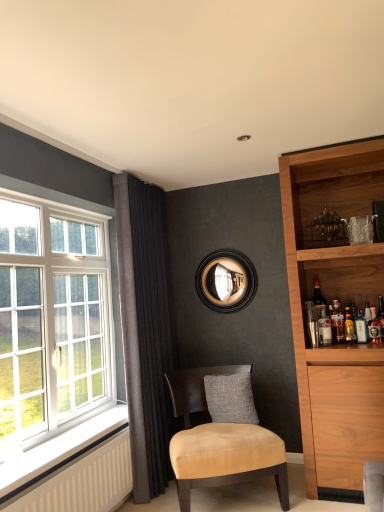
Measure the distance between point (319, 298) and camera.

Point (319, 298) and camera are 3.18 meters apart.

Describe the element at coordinates (52, 320) in the screenshot. This screenshot has height=512, width=384. I see `white glass window at left` at that location.

Measure the distance between point [380,337] and camera.

Point [380,337] is 10.02 feet from camera.

The image size is (384, 512). In order to click on translucent glass bottle at upper right, marked as the 2th beverage in a left-to-right arrangement in this screenshot , I will do `click(337, 322)`.

How much space does translucent glass bottle at right, which appears as the 1th bottle when viewed from the right, occupy vertically?

A: translucent glass bottle at right, which appears as the 1th bottle when viewed from the right, is 8.98 inches in height.

Measure the distance between translucent glass bottle at right, placed as the second bottle when sorted from left to right, and camera.

translucent glass bottle at right, placed as the second bottle when sorted from left to right, and camera are 2.99 meters apart.

Where is `shiny dark glass bottle at upper right, the 1th bottle when ordered from back to front`? shiny dark glass bottle at upper right, the 1th bottle when ordered from back to front is located at coordinates (318, 298).

Find the location of a particular element. The width and height of the screenshot is (384, 512). window on the left side of shiny dark glass bottle at upper right, which is the second bottle from right to left is located at coordinates (52, 320).

Are white glass window at left and shiny dark glass bottle at upper right, which is the second bottle from right to left, located far from each other?

Absolutely, white glass window at left is distant from shiny dark glass bottle at upper right, which is the second bottle from right to left.

Between white glass window at left and shiny dark glass bottle at upper right, the 1th bottle when ordered from back to front, which one has more height?

white glass window at left is taller.

Which object is positioned more to the right, white glass window at left or shiny dark glass bottle at upper right, the first bottle when ordered from left to right?

From the viewer's perspective, shiny dark glass bottle at upper right, the first bottle when ordered from left to right, appears more on the right side.

From a real-world perspective, is white glass window at left under suede beige chair at center?

No, from a real-world perspective, white glass window at left is not under suede beige chair at center.

Is white glass window at left further to the viewer compared to suede beige chair at center?

No.

Is white glass window at left positioned with its back to suede beige chair at center?

No, white glass window at left is not facing the opposite direction of suede beige chair at center.

Considering the sizes of objects white glass window at left and suede beige chair at center in the image provided, who is taller, white glass window at left or suede beige chair at center?

Standing taller between the two is white glass window at left.

Considering the positions of objects black wood mirror at upper center and shiny dark glass bottle at upper right, which is the second bottle from right to left, in the image provided, who is in front, black wood mirror at upper center or shiny dark glass bottle at upper right, which is the second bottle from right to left,?

shiny dark glass bottle at upper right, which is the second bottle from right to left.

From the image's perspective, between black wood mirror at upper center and shiny dark glass bottle at upper right, which is the second bottle from right to left, who is located below?

shiny dark glass bottle at upper right, which is the second bottle from right to left, appears lower in the image.

Between black wood mirror at upper center and shiny dark glass bottle at upper right, which is the second bottle from right to left, which one has smaller size?

Smaller between the two is shiny dark glass bottle at upper right, which is the second bottle from right to left.

Locate an element on the screen. Image resolution: width=384 pixels, height=512 pixels. picture frame lying above the shiny dark glass bottle at upper right, which is the second bottle from right to left (from the image's perspective) is located at coordinates (226, 281).

From the image's perspective, relative to gray fabric pillow at center, is shiny dark glass bottle at upper right, the first bottle when ordered from left to right, above or below?

Clearly, from the image's perspective, shiny dark glass bottle at upper right, the first bottle when ordered from left to right, is above gray fabric pillow at center.

From a real-world perspective, who is located lower, shiny dark glass bottle at upper right, marked as the 2th bottle in a front-to-back arrangement, or gray fabric pillow at center?

gray fabric pillow at center.

This screenshot has width=384, height=512. I want to click on the 2nd bottle directly above the gray fabric pillow at center (from a real-world perspective), so click(x=318, y=298).

Is gray fabric pillow at center at the back of shiny dark glass bottle at upper right, the first bottle when ordered from left to right?

No, shiny dark glass bottle at upper right, the first bottle when ordered from left to right, is not facing the opposite direction of gray fabric pillow at center.

Consider the image. Who is shorter, translucent glass bottle at upper right, marked as the 2th beverage in a left-to-right arrangement, or suede beige chair at center?

translucent glass bottle at upper right, marked as the 2th beverage in a left-to-right arrangement.

What's the angular difference between translucent glass bottle at upper right, which appears as the 3th beverage when viewed from the right, and suede beige chair at center's facing directions?

translucent glass bottle at upper right, which appears as the 3th beverage when viewed from the right, and suede beige chair at center are facing 31.9 degrees away from each other.

From a real-world perspective, starting from the suede beige chair at center, which beverage is the 4th one vertically above it? Please provide its 2D coordinates.

[(337, 322)]

How far apart are translucent glass bottle at upper right, marked as the 2th beverage in a left-to-right arrangement, and suede beige chair at center?

translucent glass bottle at upper right, marked as the 2th beverage in a left-to-right arrangement, and suede beige chair at center are 1.07 meters apart.

How different are the orientations of gray fabric pillow at center and suede beige chair at center in degrees?

There is a 40.1-degree angle between the facing directions of gray fabric pillow at center and suede beige chair at center.

Locate an element on the screen. pillow located above the suede beige chair at center (from a real-world perspective) is located at coordinates (230, 398).

Is gray fabric pillow at center at the right side of suede beige chair at center?

Correct, you'll find gray fabric pillow at center to the right of suede beige chair at center.

Consider the image. Based on their positions, is white glass window at left located to the left or right of translucent glass bottle at upper right, which appears as the 3th beverage when viewed from the right?

white glass window at left is to the left of translucent glass bottle at upper right, which appears as the 3th beverage when viewed from the right.

Is point (102, 344) closer to camera compared to point (343, 328)?

No.

Who is taller, white glass window at left or translucent glass bottle at upper right, marked as the 2th beverage in a left-to-right arrangement?

With more height is white glass window at left.

You are a GUI agent. You are given a task and a screenshot of the screen. Output one action in this format:
    pyautogui.click(x=<x>, y=<y>)
    Task: Click on the bottle above the white glass window at left (from the image's perspective)
    The width and height of the screenshot is (384, 512).
    Given the screenshot: What is the action you would take?
    pyautogui.click(x=318, y=298)

What are the coordinates of `chair that appears behind the white glass window at left` in the screenshot? It's located at (220, 442).

From the image, which object appears to be farther from clear glass bottle at upper right, acting as the fourth beverage starting from the right, white glass window at left or gray fabric pillow at center?

white glass window at left lies further to clear glass bottle at upper right, acting as the fourth beverage starting from the right, than the other object.

When comparing their distances from white glass window at left, does translucent glass bottle at right, which appears as the second bottle when viewed from the back, or translucent glass bottle at right, placed as the first beverage when sorted from right to left, seem further?

Among the two, translucent glass bottle at right, placed as the first beverage when sorted from right to left, is located further to white glass window at left.

Based on their spatial positions, is white glass window at left or gray fabric pillow at center further from white textured radiator at lower left?

gray fabric pillow at center is positioned further to the anchor white textured radiator at lower left.

Estimate the real-world distances between objects in this image. Which object is further from translucent glass bottle at right, the 1th bottle in the front-to-back sequence, translucent glass bottle at right, the fourth beverage positioned from the left, or gray fabric pillow at center?

gray fabric pillow at center is further to translucent glass bottle at right, the 1th bottle in the front-to-back sequence.

Which object lies nearer to the anchor point shiny dark glass bottle at upper right, the first bottle when ordered from left to right, black wood mirror at upper center or translucent glass bottle at right, the 2th beverage from the right?

translucent glass bottle at right, the 2th beverage from the right.

Considering their positions, is translucent glass bottle at upper right, which appears as the 3th beverage when viewed from the right, positioned closer to clear glass bottle at upper right, placed as the 1th beverage when sorted from left to right, than shiny dark glass bottle at upper right, which is the second bottle from right to left?

The object closer to clear glass bottle at upper right, placed as the 1th beverage when sorted from left to right, is translucent glass bottle at upper right, which appears as the 3th beverage when viewed from the right.

Looking at the image, which one is located closer to translucent glass bottle at right, which appears as the 1th bottle when viewed from the right, white glass window at left or translucent glass bottle at right, the fourth beverage positioned from the left?

translucent glass bottle at right, the fourth beverage positioned from the left, is positioned closer to the anchor translucent glass bottle at right, which appears as the 1th bottle when viewed from the right.

Looking at the image, which one is located closer to clear glass bottle at upper right, acting as the fourth beverage starting from the right, black wood mirror at upper center or translucent glass bottle at right, which appears as the second bottle when viewed from the back?

Based on the image, translucent glass bottle at right, which appears as the second bottle when viewed from the back, appears to be nearer to clear glass bottle at upper right, acting as the fourth beverage starting from the right.

Where is `radiator between white glass window at left and clear glass bottle at upper right, acting as the fourth beverage starting from the right, in the horizontal direction`? This screenshot has width=384, height=512. radiator between white glass window at left and clear glass bottle at upper right, acting as the fourth beverage starting from the right, in the horizontal direction is located at coordinates (83, 481).

Where is `chair situated between white textured radiator at lower left and translucent glass bottle at upper right, marked as the 2th beverage in a left-to-right arrangement, from left to right`? The height and width of the screenshot is (512, 384). chair situated between white textured radiator at lower left and translucent glass bottle at upper right, marked as the 2th beverage in a left-to-right arrangement, from left to right is located at coordinates (220, 442).

Identify the location of pillow between dark grey velvet curtain at left and translucent glass bottle at right, the 2th beverage from the right. (230, 398).

The height and width of the screenshot is (512, 384). Find the location of `picture frame between white textured radiator at lower left and translucent glass bottle at right, placed as the first beverage when sorted from right to left`. picture frame between white textured radiator at lower left and translucent glass bottle at right, placed as the first beverage when sorted from right to left is located at coordinates (226, 281).